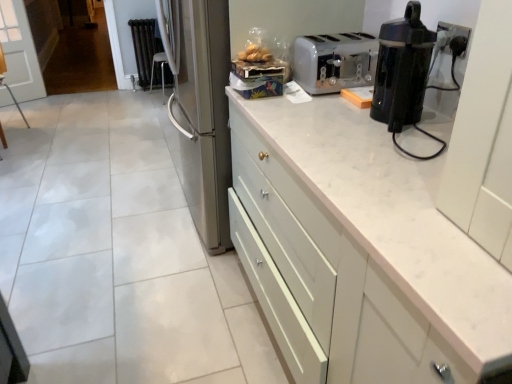
Question: From a real-world perspective, is black metallic radiator at upper left on top of translucent plastic bag of bread at upper center?

Choices:
 (A) yes
 (B) no

Answer: (B)

Question: Is black metallic radiator at upper left smaller than translucent plastic bag of bread at upper center?

Choices:
 (A) no
 (B) yes

Answer: (A)

Question: Considering the relative sizes of black metallic radiator at upper left and translucent plastic bag of bread at upper center in the image provided, is black metallic radiator at upper left taller than translucent plastic bag of bread at upper center?

Choices:
 (A) yes
 (B) no

Answer: (A)

Question: Is there a large distance between black metallic radiator at upper left and translucent plastic bag of bread at upper center?

Choices:
 (A) yes
 (B) no

Answer: (A)

Question: Considering the relative sizes of black metallic radiator at upper left and translucent plastic bag of bread at upper center in the image provided, is black metallic radiator at upper left shorter than translucent plastic bag of bread at upper center?

Choices:
 (A) yes
 (B) no

Answer: (B)

Question: Relative to white plastic toaster at upper right, is translucent plastic bag of bread at upper center in front or behind?

Choices:
 (A) front
 (B) behind

Answer: (B)

Question: Is translucent plastic bag of bread at upper center wider or thinner than white plastic toaster at upper right?

Choices:
 (A) thin
 (B) wide

Answer: (A)

Question: Based on their positions, is translucent plastic bag of bread at upper center located to the left or right of white plastic toaster at upper right?

Choices:
 (A) right
 (B) left

Answer: (B)

Question: From the image's perspective, is translucent plastic bag of bread at upper center located above or below white plastic toaster at upper right?

Choices:
 (A) above
 (B) below

Answer: (A)

Question: Considering the relative positions of white plastic toaster at upper right and black metallic radiator at upper left in the image provided, is white plastic toaster at upper right to the left or to the right of black metallic radiator at upper left?

Choices:
 (A) right
 (B) left

Answer: (A)

Question: In terms of width, does white plastic toaster at upper right look wider or thinner when compared to black metallic radiator at upper left?

Choices:
 (A) thin
 (B) wide

Answer: (B)

Question: From the image's perspective, relative to black metallic radiator at upper left, is white plastic toaster at upper right above or below?

Choices:
 (A) above
 (B) below

Answer: (B)

Question: Which is correct: white plastic toaster at upper right is inside black metallic radiator at upper left, or outside of it?

Choices:
 (A) inside
 (B) outside

Answer: (B)

Question: In terms of size, does black metallic radiator at upper left appear bigger or smaller than white matte cabinet at upper right?

Choices:
 (A) big
 (B) small

Answer: (B)

Question: In the image, is black metallic radiator at upper left positioned in front of or behind white matte cabinet at upper right?

Choices:
 (A) front
 (B) behind

Answer: (B)